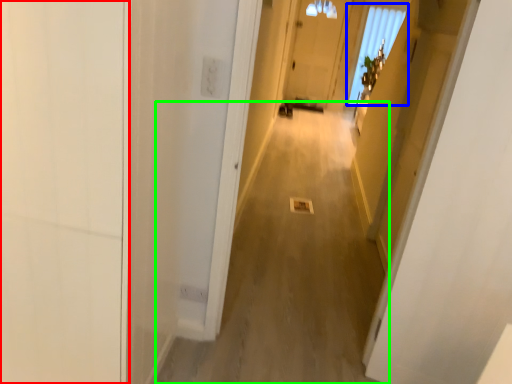
Question: Based on their relative distances, which object is farther from door (highlighted by a red box)? Choose from window (highlighted by a blue box) and alley (highlighted by a green box).

Choices:
 (A) window
 (B) alley

Answer: (A)